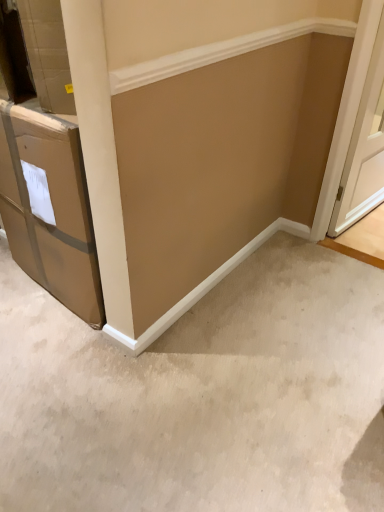
Question: Is point (170, 455) positioned closer to the camera than point (375, 41)?

Choices:
 (A) closer
 (B) farther

Answer: (A)

Question: In terms of size, does beige carpet at lower center appear bigger or smaller than white wood door at right?

Choices:
 (A) big
 (B) small

Answer: (B)

Question: From their relative heights in the image, would you say beige carpet at lower center is taller or shorter than white wood door at right?

Choices:
 (A) tall
 (B) short

Answer: (B)

Question: From the image's perspective, is white wood door at right located above or below beige carpet at lower center?

Choices:
 (A) below
 (B) above

Answer: (B)

Question: Is white wood door at right to the left or to the right of beige carpet at lower center in the image?

Choices:
 (A) left
 (B) right

Answer: (B)

Question: In the image, is white wood door at right positioned in front of or behind beige carpet at lower center?

Choices:
 (A) front
 (B) behind

Answer: (B)

Question: Considering the positions of white wood door at right and beige carpet at lower center in the image, is white wood door at right taller or shorter than beige carpet at lower center?

Choices:
 (A) short
 (B) tall

Answer: (B)